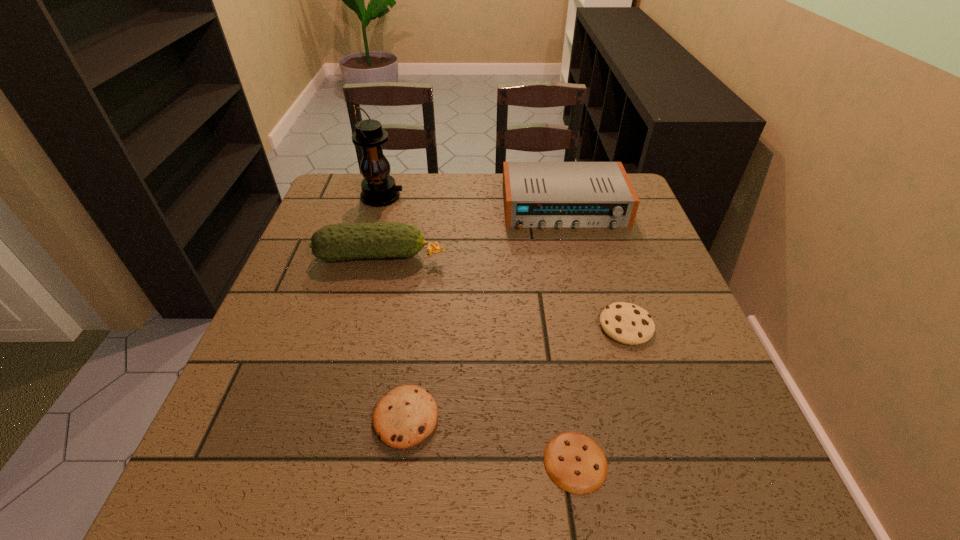
Where is `the tallest object`? the tallest object is located at coordinates (379, 189).

Locate an element on the screen. The width and height of the screenshot is (960, 540). the fourth nearest object is located at coordinates (336, 242).

Where is `radio receiver`? This screenshot has height=540, width=960. radio receiver is located at coordinates (536, 194).

The height and width of the screenshot is (540, 960). What are the coordinates of `the farthest cookie` in the screenshot? It's located at (626, 323).

This screenshot has height=540, width=960. I want to click on the fourth farthest object, so click(x=626, y=323).

Find the location of `the fifth tallest object`. the fifth tallest object is located at coordinates (407, 415).

Locate an element on the screen. The height and width of the screenshot is (540, 960). the second tallest cookie is located at coordinates (407, 415).

This screenshot has width=960, height=540. Identify the location of the shortest cookie. click(574, 462).

Identify the location of the shortest object. (574, 462).

Select a few points in the free space located 0.390m above the tallest object, indicating its light source. Please provide its 2D coordinates. Your answer should be formatted as a tuple, i.e. [(x, y)], where the tuple contains the x and y coordinates of a point satisfying the conditions above.

[(536, 197)]